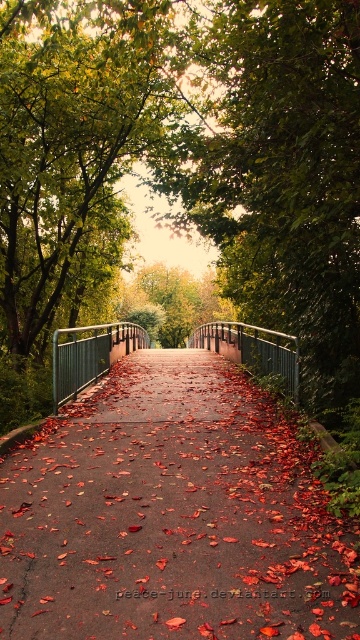
Question: Which object is farther from the camera taking this photo?

Choices:
 (A) green leafy tree at center
 (B) metallic bridge at center

Answer: (B)

Question: Which point appears farthest from the camera in this image?

Choices:
 (A) (56, 388)
 (B) (317, 588)
 (C) (270, 3)

Answer: (A)

Question: Which point is farther to the camera?

Choices:
 (A) metallic bridge at center
 (B) green leafy tree at center
 (C) smooth asphalt path at center

Answer: (A)

Question: Can you confirm if smooth asphalt path at center is positioned to the left of metallic bridge at center?

Choices:
 (A) no
 (B) yes

Answer: (B)

Question: From the image, what is the correct spatial relationship of green leafy tree at center in relation to metallic bridge at center?

Choices:
 (A) right
 (B) left

Answer: (A)

Question: Is smooth asphalt path at center behind green leafy tree at center?

Choices:
 (A) yes
 (B) no

Answer: (B)